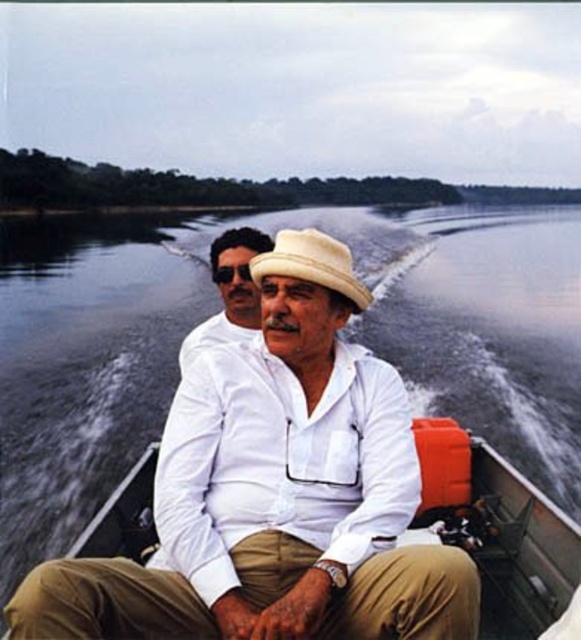
You are a photographer trying to capture a clear shot of both the white fabric boat at center and the matte white shirt at center. Since the boat and shirt are both white, you need to adjust your focus to ensure both are in sharp detail. Which object should you focus on first to ensure it is in focus, considering their positions?

The white fabric boat at center is closer to the viewer than the matte white shirt at center, so you should focus on the white fabric boat at center first to ensure it is in focus before adjusting for the matte white shirt at center.

You are standing on the dock and want to reach the point marked as point [514,545] in the water. If your boat can travel 12 feet, will you be able to reach that point?

The distance of point [514,545] from viewer is 10.47 feet, so yes, the boat can reach it since it can travel 12 feet which is more than the required distance.

You are a photographer trying to capture a clear shot of both the white cotton shirt at center and the white fabric boat at center. Since both are white, you want to ensure they are distinguishable in your photo. Based on their positions, which object should you focus on first to ensure proper framing?

The white cotton shirt at center is to the left of white fabric boat at center, so focusing on the white cotton shirt at center first will help distinguish it from the boat by its position to the left.